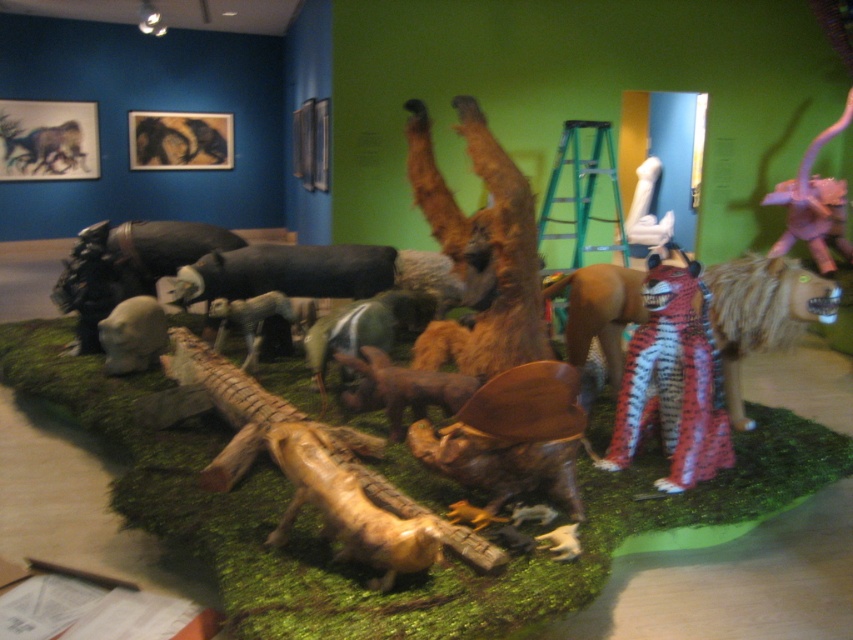
Question: Does wooden log at center have a larger size compared to brown matte elephant at center?

Choices:
 (A) yes
 (B) no

Answer: (B)

Question: Is green moss at center wider than smooth gray elephant at center?

Choices:
 (A) no
 (B) yes

Answer: (B)

Question: Which point appears farthest from the camera in this image?

Choices:
 (A) (746, 284)
 (B) (413, 520)
 (C) (141, 310)
 (D) (682, 476)

Answer: (C)

Question: Estimate the real-world distances between objects in this image. Which object is closer to the brown fur horse at upper left?

Choices:
 (A) plush tiger costume at center
 (B) shiny black animal at upper left

Answer: (B)

Question: Can you confirm if brown leather chair at center is positioned to the right of brown matte elephant at center?

Choices:
 (A) yes
 (B) no

Answer: (A)

Question: Which point is closer to the camera taking this photo?

Choices:
 (A) (651, 401)
 (B) (288, 298)
 (C) (338, 362)
 (D) (114, 339)

Answer: (A)